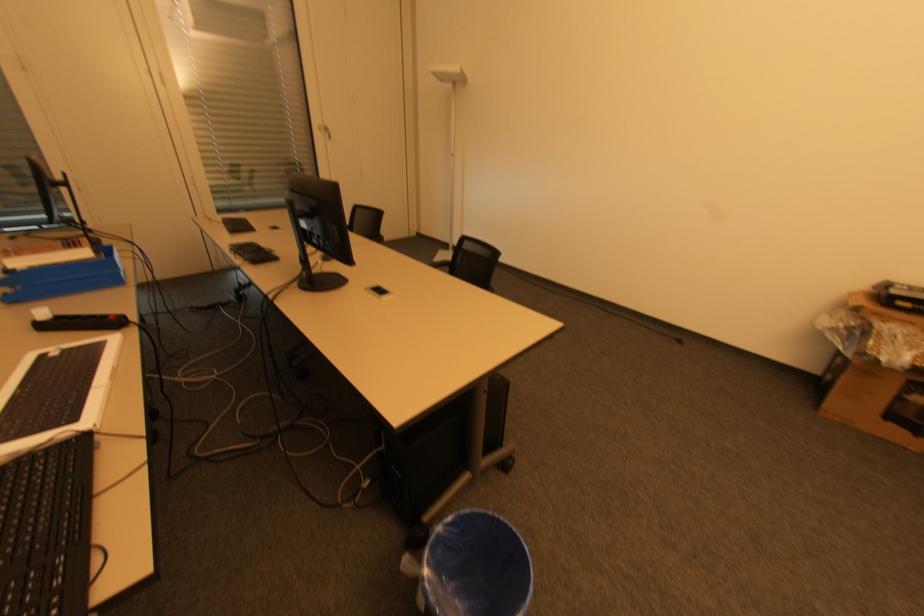
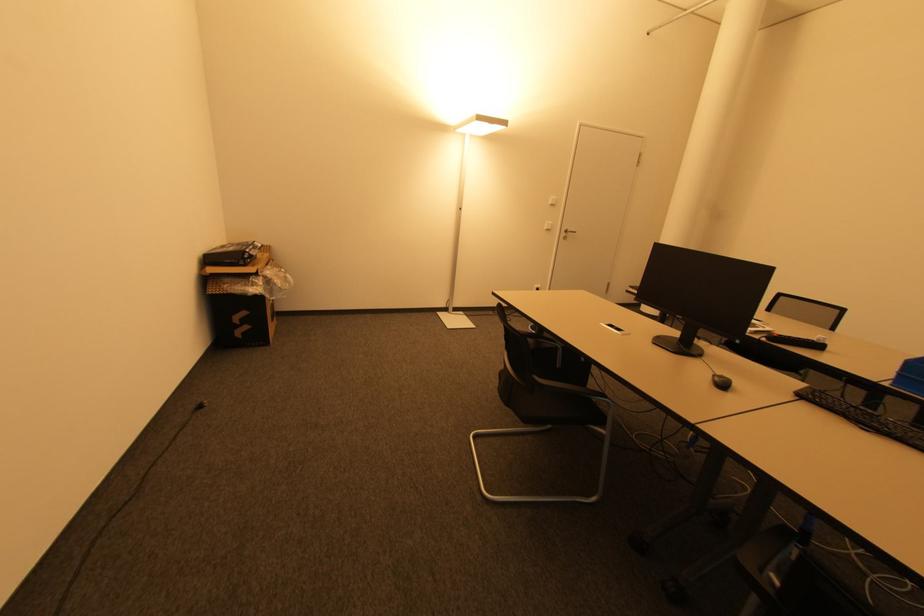
Locate, in the second image, the point that corresponds to pixel 681 341 in the first image.

(201, 408)